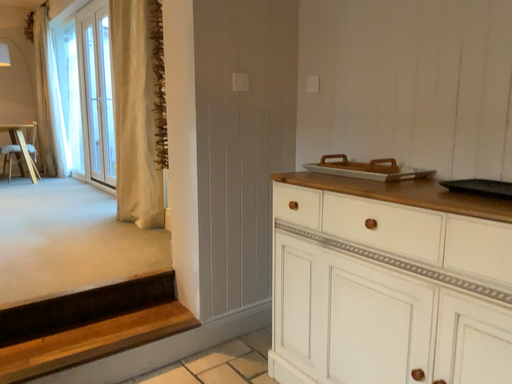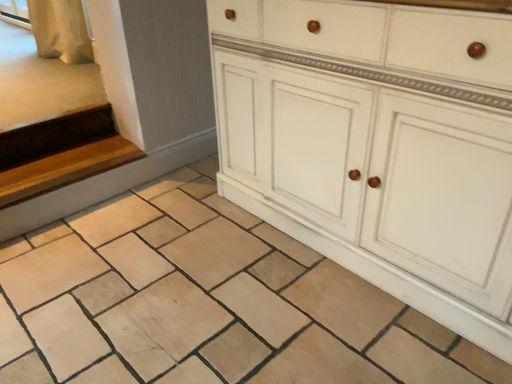
Question: How did the camera likely rotate when shooting the video?

Choices:
 (A) rotated upward
 (B) rotated downward

Answer: (B)